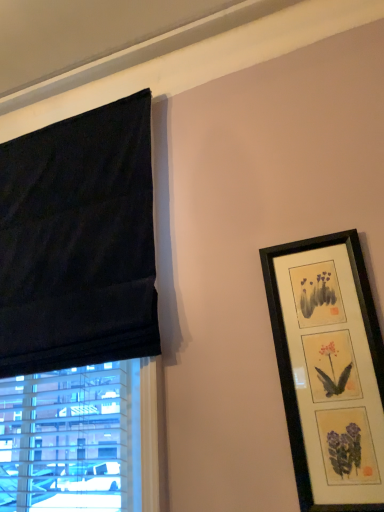
Image resolution: width=384 pixels, height=512 pixels. What do you see at coordinates (330, 368) in the screenshot?
I see `wooden framed artwork at right` at bounding box center [330, 368].

Measure the distance between point (297, 408) and camera.

A distance of 3.56 feet exists between point (297, 408) and camera.

At what (x,y) coordinates should I click in order to perform the action: click on wooden framed artwork at right. Please return your answer as a coordinate pair (x, y). Looking at the image, I should click on (330, 368).

What are the coordinates of `wooden framed artwork at right` in the screenshot? It's located at point(330,368).